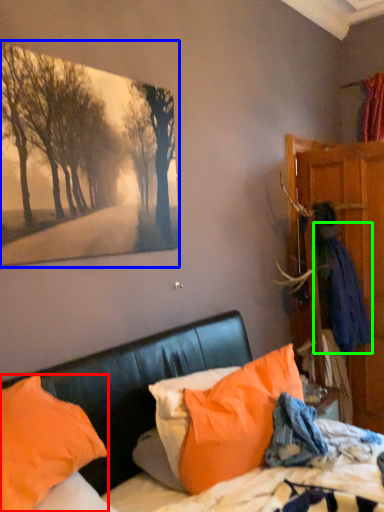
Question: Estimate the real-world distances between objects in this image. Which object is closer to pillow (highlighted by a red box), picture frame (highlighted by a blue box) or clothing (highlighted by a green box)?

Choices:
 (A) picture frame
 (B) clothing

Answer: (A)